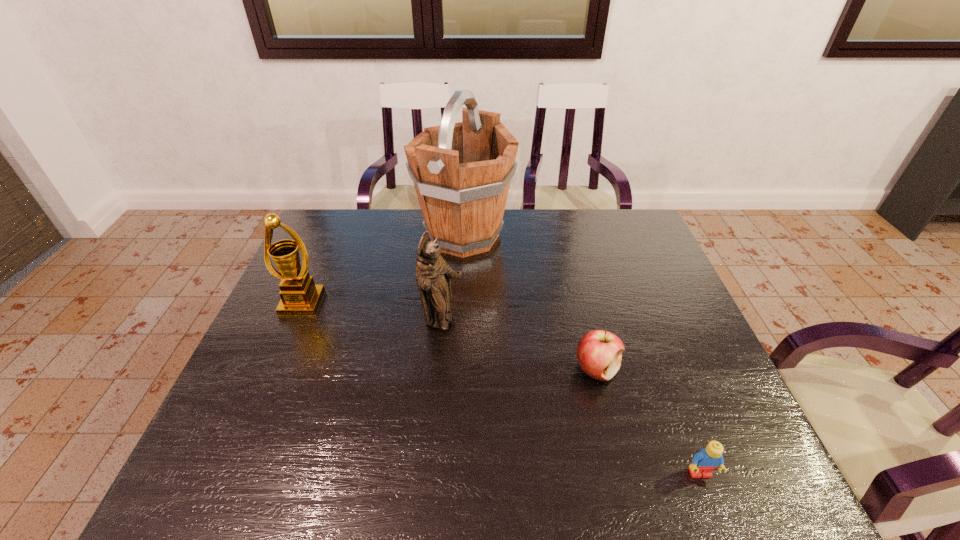
Locate an element on the screen. free space between the Lego and the figurine is located at coordinates (571, 397).

I want to click on vacant point located between the award and the second nearest object, so click(449, 336).

The height and width of the screenshot is (540, 960). Identify the location of free space between the nearest object and the second object from right to left. (648, 421).

Locate an element on the screen. object that stands as the third closest to the leftmost object is located at coordinates (599, 352).

Locate which object is the fourth closest to the second nearest object. Please provide its 2D coordinates. Your answer should be formatted as a tuple, i.e. [(x, y)], where the tuple contains the x and y coordinates of a point satisfying the conditions above.

[(300, 296)]

The image size is (960, 540). Find the location of `free spot that satisfies the following two spatial constraints: 1. on the front-facing side of the figurine; 2. on the left side of the apple`. free spot that satisfies the following two spatial constraints: 1. on the front-facing side of the figurine; 2. on the left side of the apple is located at coordinates (438, 369).

Locate an element on the screen. This screenshot has width=960, height=540. free space that satisfies the following two spatial constraints: 1. on the front-facing side of the second nearest object; 2. on the left side of the award is located at coordinates (274, 369).

The image size is (960, 540). Find the location of `vacant area in the image that satisfies the following two spatial constraints: 1. on the front-facing side of the second object from right to left; 2. on the right side of the award`. vacant area in the image that satisfies the following two spatial constraints: 1. on the front-facing side of the second object from right to left; 2. on the right side of the award is located at coordinates 274,369.